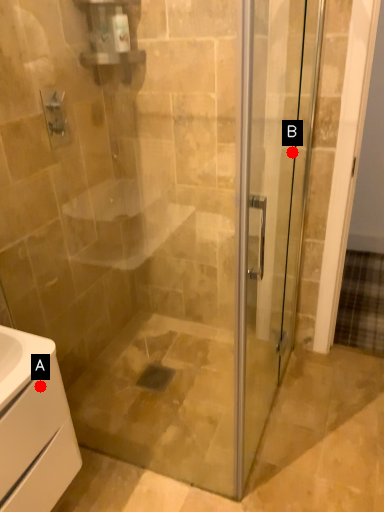
Question: Two points are circled on the image, labeled by A and B beside each circle. Which of the following is the farthest from the observer?

Choices:
 (A) A is further
 (B) B is further

Answer: (B)